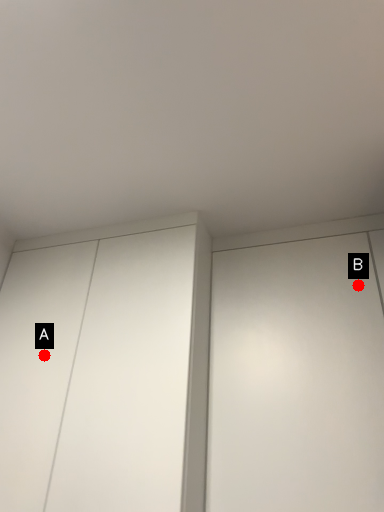
Question: Two points are circled on the image, labeled by A and B beside each circle. Which point appears closest to the camera in this image?

Choices:
 (A) A is closer
 (B) B is closer

Answer: (B)